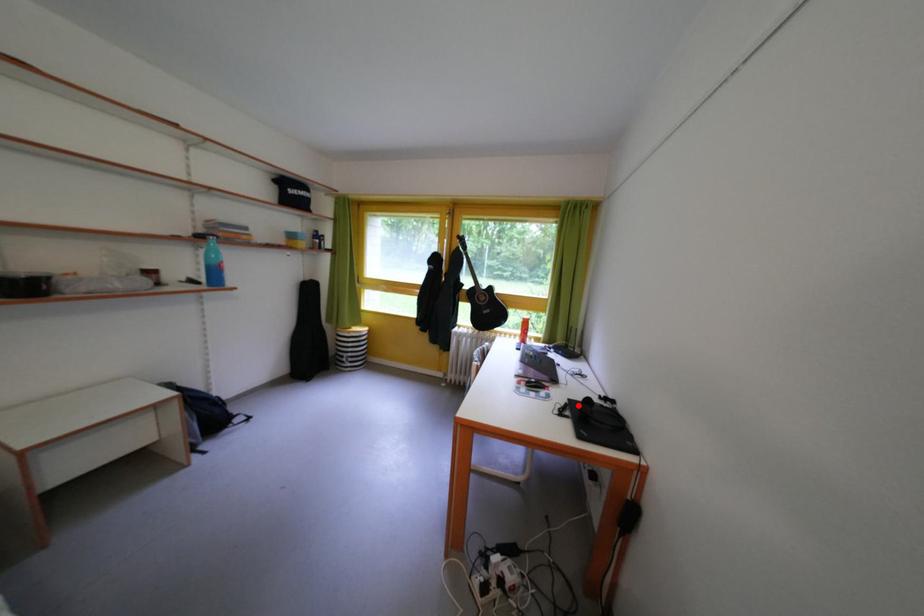
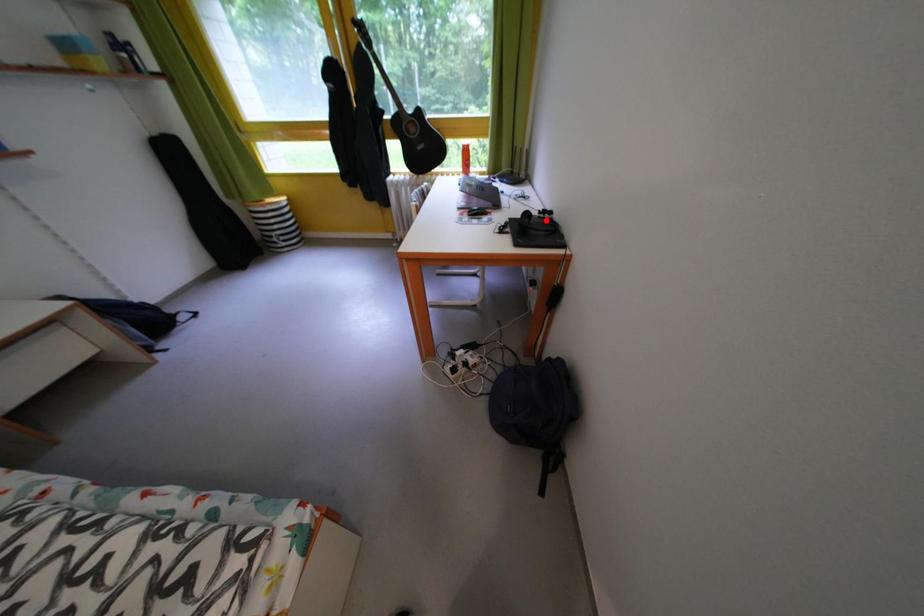
I am providing you with two images of the same scene from different viewpoints. A red point is marked on the first image and another point is marked on the second image. Are the points marked in image1 and image2 representing the same 3D position?

No